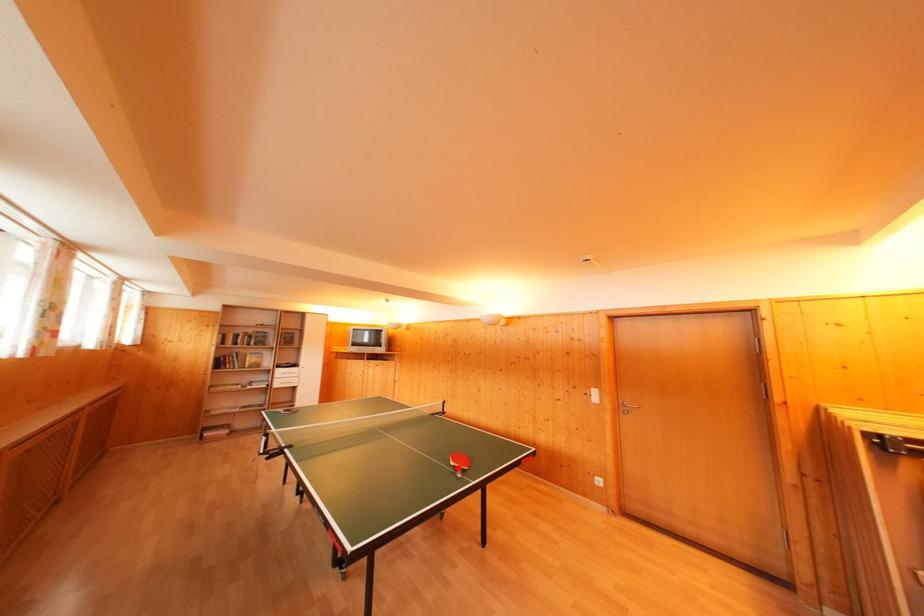
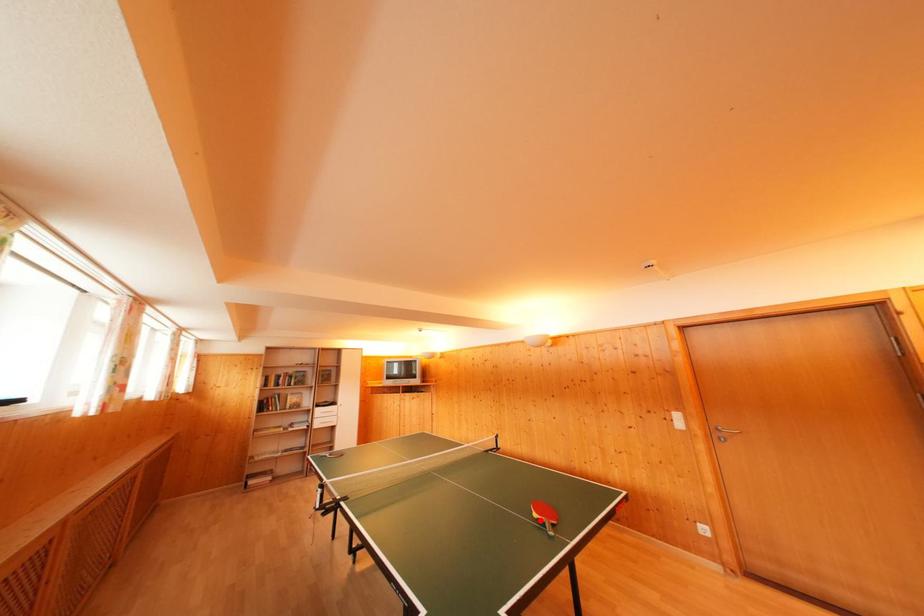
I am providing you with two images of the same scene from different viewpoints. A red point is marked on the first image and another point is marked on the second image. Do the highlighted points in image1 and image2 indicate the same real-world spot?

Yes